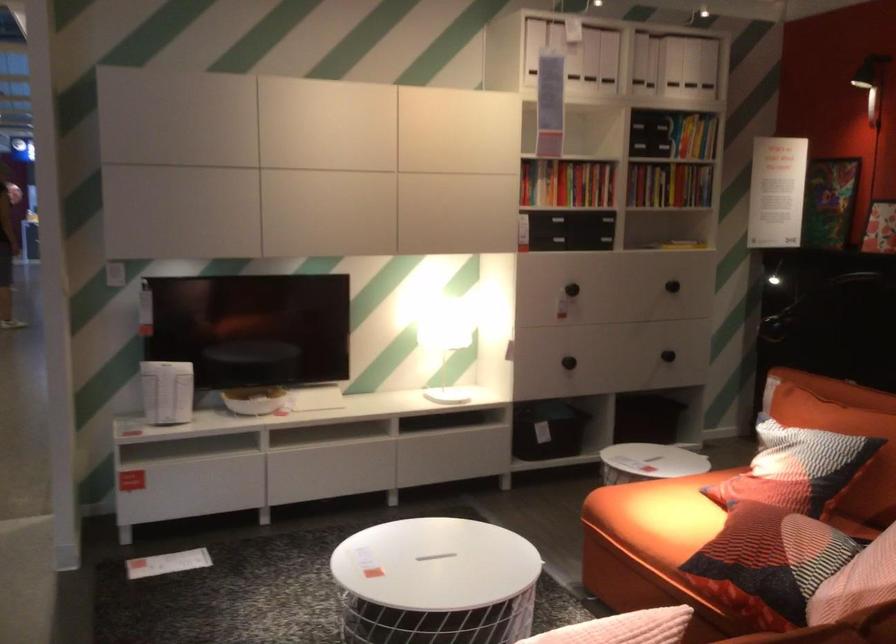
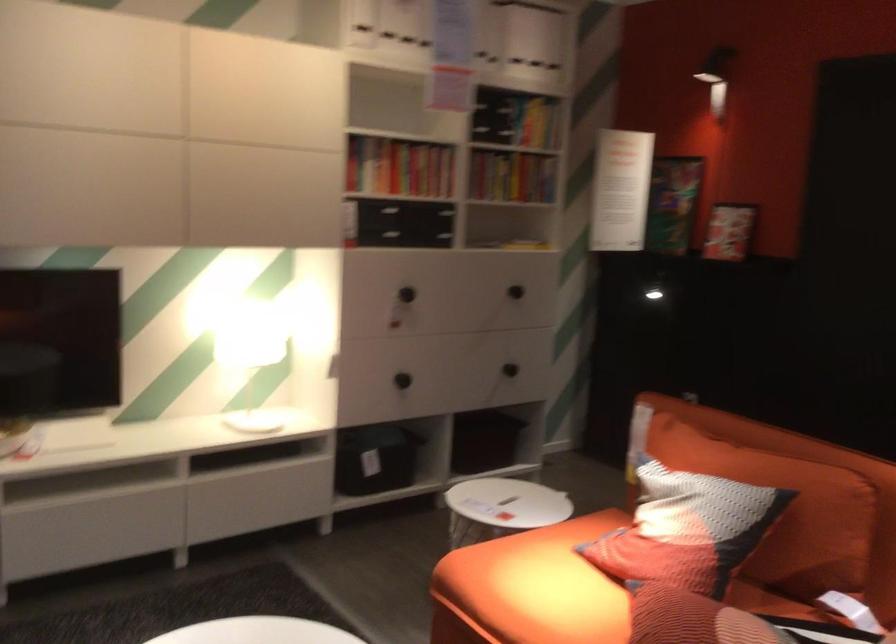
The point at (x=580, y=355) is marked in the first image. Where is the corresponding point in the second image?

(401, 380)